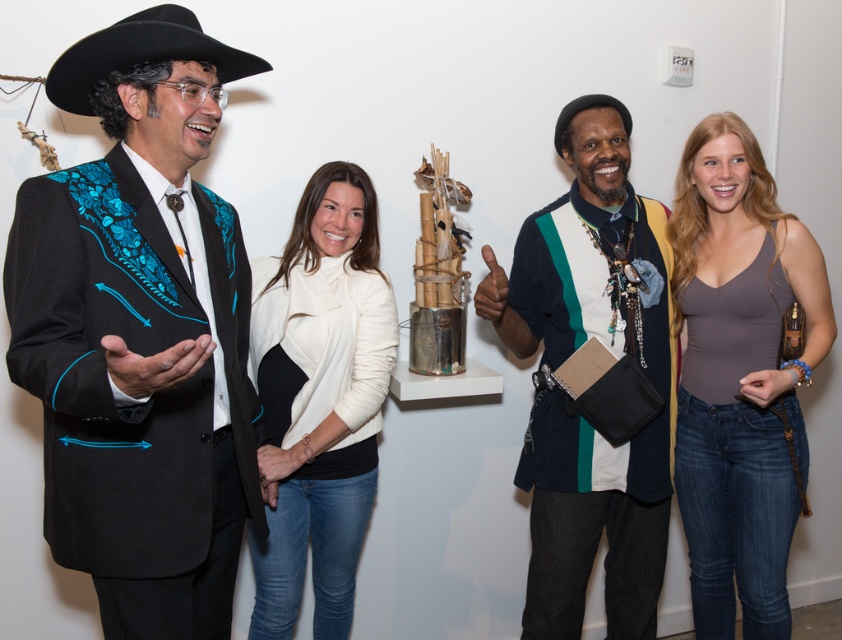
You are an artist trying to paint the scene. You need to decide which object to paint first based on their sizes. Which should you paint first, the white matte jacket at center or the black felt cowboy hat at upper left?

The white matte jacket at center should be painted first because its width is larger than the black felt cowboy hat at upper left.

You are a fashion designer observing the clothing items in the image. Which clothing item, the multicolored knitted sweater at center or the white matte jacket at center, would you recommend for someone who wants to create a bold and eye catching outfit?

The multicolored knitted sweater at center has a larger size compared to white matte jacket at center, making it a more eye catching option for a bold outfit.